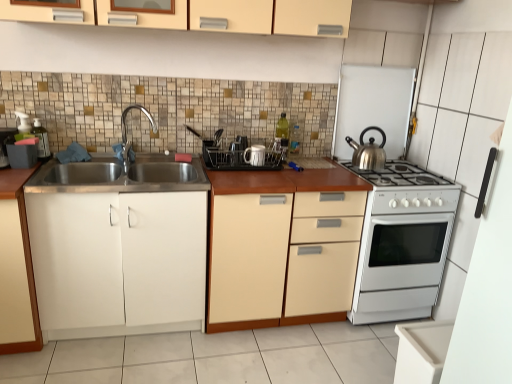
Find the location of a particular element. unoccupied region to the right of black plastic dish rack at center, the third appliance in the left-to-right sequence is located at coordinates (310, 172).